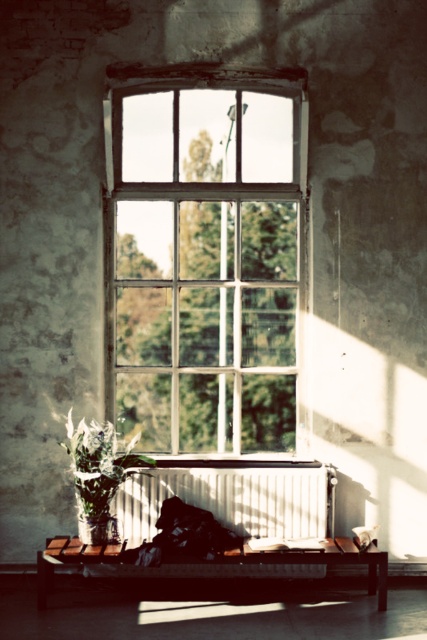
Can you confirm if wooden bench at center is positioned below velvety black pillow at lower right?

Correct, wooden bench at center is located below velvety black pillow at lower right.

Is wooden bench at center further to the viewer compared to velvety black pillow at lower right?

No, it is not.

Which is behind, point (70, 563) or point (362, 532)?

Positioned behind is point (362, 532).

What are the coordinates of `wooden bench at center` in the screenshot? It's located at (216, 564).

Can you confirm if green matte plant at lower left is thinner than velvety black pillow at lower right?

No.

Consider the image. Between green matte plant at lower left and velvety black pillow at lower right, which one appears on the left side from the viewer's perspective?

Positioned to the left is green matte plant at lower left.

I want to click on green matte plant at lower left, so click(99, 474).

Between clear glass window at center and wooden bench at center, which one appears on the left side from the viewer's perspective?

clear glass window at center

What do you see at coordinates (205, 253) in the screenshot?
I see `clear glass window at center` at bounding box center [205, 253].

At what (x,y) coordinates should I click in order to perform the action: click on clear glass window at center. Please return your answer as a coordinate pair (x, y). This screenshot has height=640, width=427. Looking at the image, I should click on (205, 253).